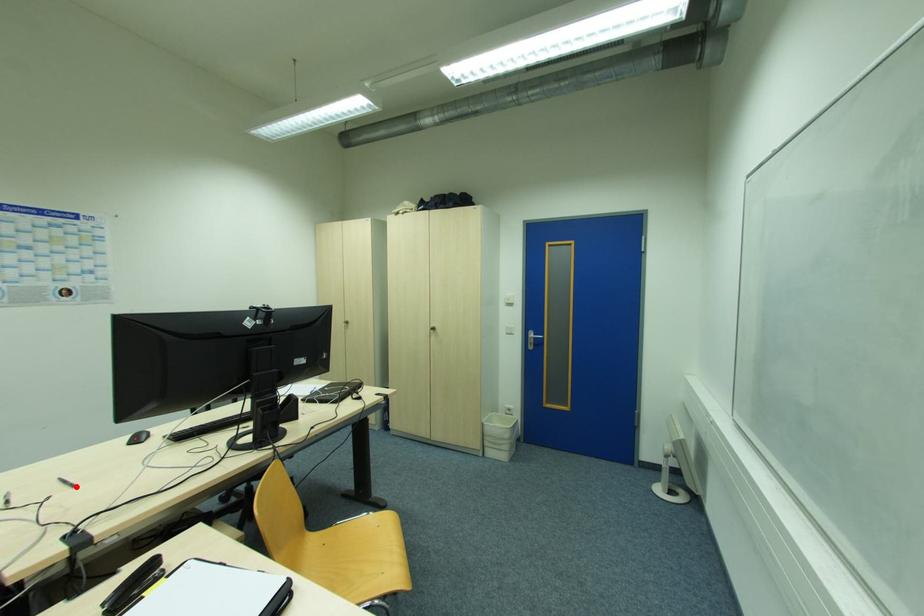
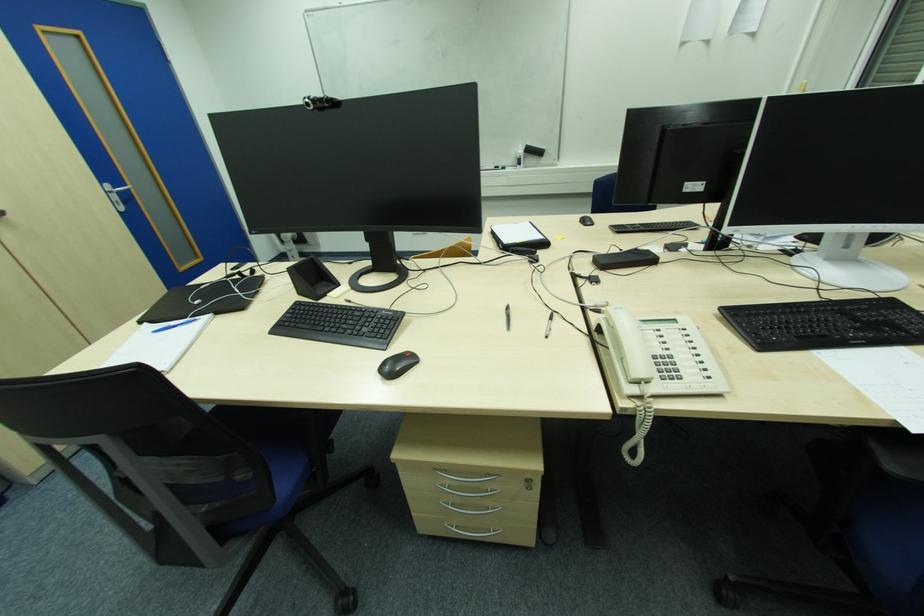
Locate, in the second image, the point that corresponds to the highlighted location in the first image.

(509, 309)